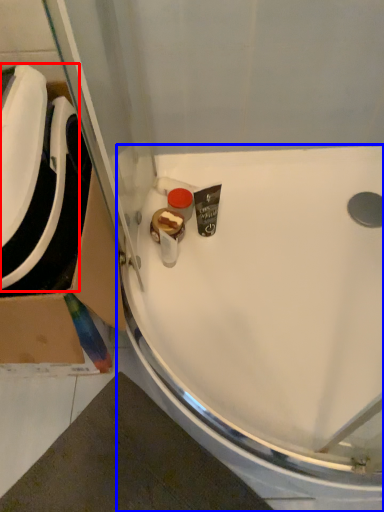
Question: Which object appears farthest to the camera in this image, sink (highlighted by a red box) or sink (highlighted by a blue box)?

Choices:
 (A) sink
 (B) sink

Answer: (B)